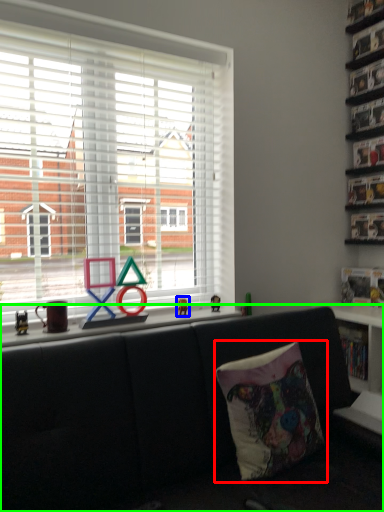
Question: Based on their relative distances, which object is farther from pillow (highlighted by a red box)? Choose from miniature (highlighted by a blue box) and studio couch (highlighted by a green box).

Choices:
 (A) miniature
 (B) studio couch

Answer: (A)